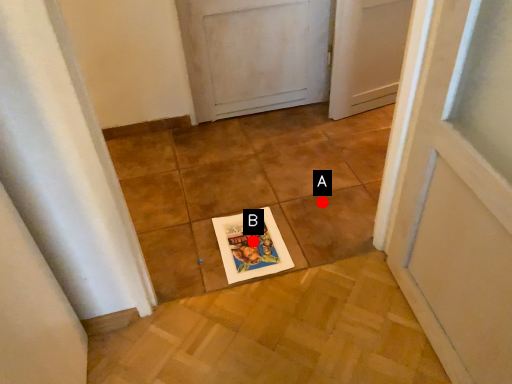
Question: Two points are circled on the image, labeled by A and B beside each circle. Which of the following is the closest to the observer?

Choices:
 (A) A is closer
 (B) B is closer

Answer: (B)